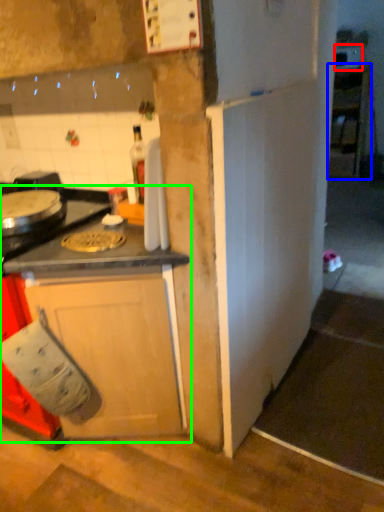
Question: Which is farther away from appliance (highlighted by a red box)? cabinetry (highlighted by a blue box) or cabinetry (highlighted by a green box)?

Choices:
 (A) cabinetry
 (B) cabinetry

Answer: (B)